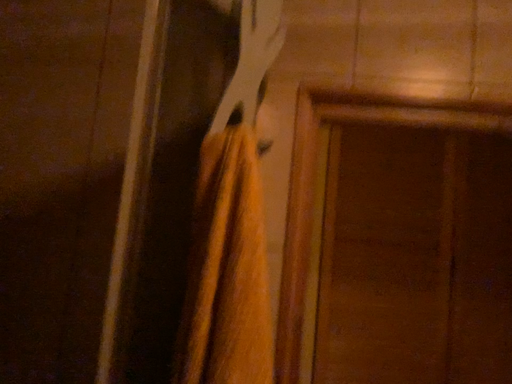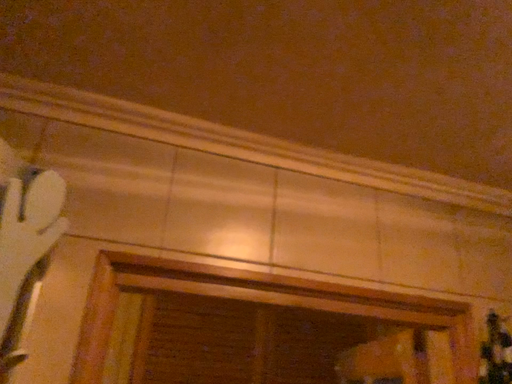
Question: Which way did the camera rotate in the video?

Choices:
 (A) rotated downward
 (B) rotated upward

Answer: (B)